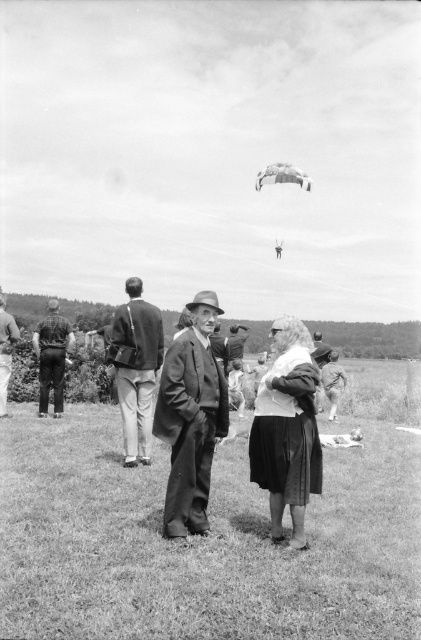
Question: Considering the real-world distances, which object is closest to the dark brown leather jacket at center?

Choices:
 (A) green grass at center
 (B) checkered fabric shirt at left

Answer: (A)

Question: Which point is closer to the camera?

Choices:
 (A) dark brown leather jacket at center
 (B) matte fabric skirt at center
 (C) white fabric parachute at upper center
 (D) checkered fabric shirt at left

Answer: (B)

Question: Is green grass at center thinner than matte fabric skirt at center?

Choices:
 (A) yes
 (B) no

Answer: (B)

Question: Does green grass at center have a larger size compared to dark brown leather jacket at center?

Choices:
 (A) no
 (B) yes

Answer: (B)

Question: Which point is closer to the camera taking this photo?

Choices:
 (A) (15, 452)
 (B) (2, 305)
 (C) (274, 328)

Answer: (C)

Question: Can you confirm if smooth leather jacket at center is positioned to the right of white fabric parachute at upper center?

Choices:
 (A) yes
 (B) no

Answer: (B)